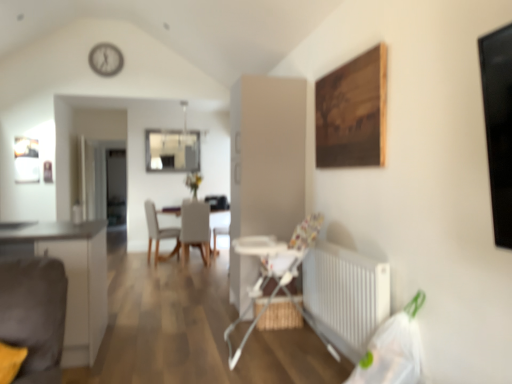
Question: Is white plastic clock at upper center aimed at transparent glass window at center?

Choices:
 (A) yes
 (B) no

Answer: (B)

Question: Are white plastic clock at upper center and transparent glass window at center making contact?

Choices:
 (A) no
 (B) yes

Answer: (A)

Question: Is white plastic clock at upper center thinner than transparent glass window at center?

Choices:
 (A) no
 (B) yes

Answer: (A)

Question: From the image's perspective, is white plastic clock at upper center above transparent glass window at center?

Choices:
 (A) yes
 (B) no

Answer: (A)

Question: From the image's perspective, is white plastic clock at upper center located beneath transparent glass window at center?

Choices:
 (A) yes
 (B) no

Answer: (B)

Question: Is white plastic clock at upper center wider than transparent glass window at center?

Choices:
 (A) no
 (B) yes

Answer: (B)

Question: Is wooden painting at upper right located within matte white cabinet at left?

Choices:
 (A) no
 (B) yes

Answer: (A)

Question: Is matte white cabinet at left not within wooden painting at upper right?

Choices:
 (A) no
 (B) yes

Answer: (B)

Question: Does matte white cabinet at left appear on the left side of wooden painting at upper right?

Choices:
 (A) yes
 (B) no

Answer: (A)

Question: Considering the relative positions of matte white cabinet at left and wooden painting at upper right in the image provided, is matte white cabinet at left to the right of wooden painting at upper right from the viewer's perspective?

Choices:
 (A) yes
 (B) no

Answer: (B)

Question: From the image's perspective, is matte white cabinet at left above wooden painting at upper right?

Choices:
 (A) yes
 (B) no

Answer: (B)

Question: Does matte white cabinet at left have a larger size compared to wooden painting at upper right?

Choices:
 (A) no
 (B) yes

Answer: (B)

Question: From the image's perspective, is white fabric chair at center, the 2th chair in the right-to-left sequence, under white plastic high chair at center?

Choices:
 (A) yes
 (B) no

Answer: (B)